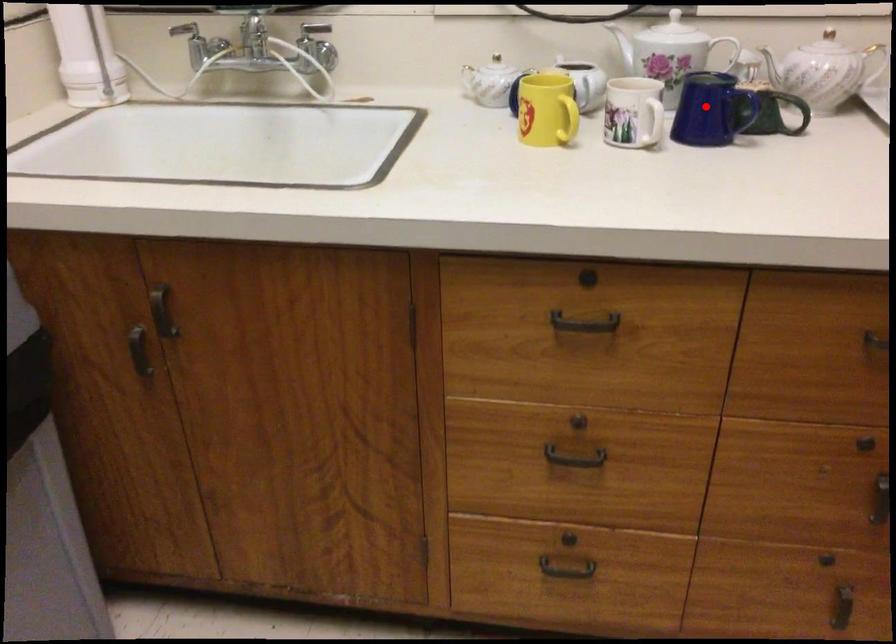
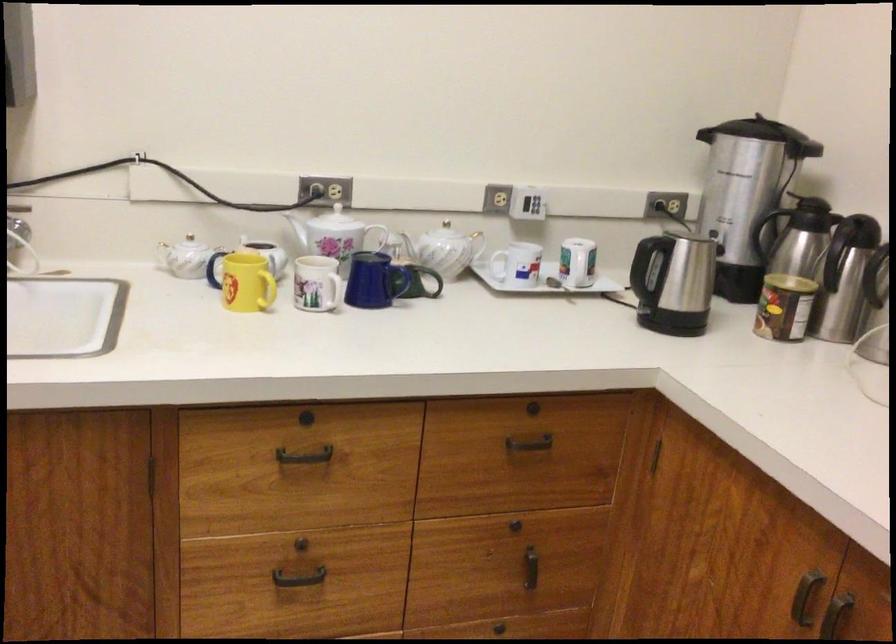
Question: I am providing you with two images of the same scene from different viewpoints. Given a red point in image1, look at the same physical point in image2. Is it:

Choices:
 (A) Closer to the viewpoint
 (B) Farther from the viewpoint

Answer: (B)